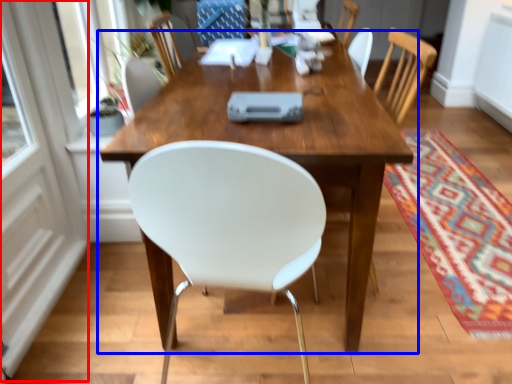
Question: Which point is closer to the camera, screen door (highlighted by a red box) or table (highlighted by a blue box)?

Choices:
 (A) screen door
 (B) table

Answer: (A)